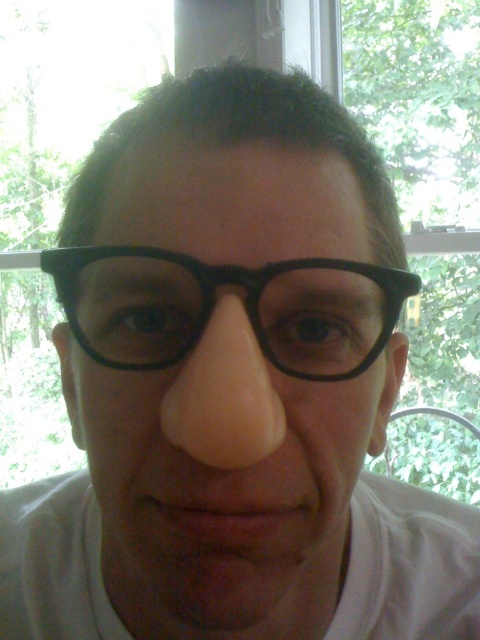
You are a photographer adjusting your camera settings to capture a close portrait. You notice the matte black glasses at center in your frame. If your camera has a minimum focusing distance of 10 inches, will you need to adjust your position to ensure the glasses are in focus?

The matte black glasses at center are only 8.62 inches away from the viewer, which is closer than the camera minimum focusing distance of 10 inches. You need to move back or increase the distance to ensure the glasses are in focus.

In the scene shown: You are trying to decide which pair of glasses to wear for a casual outdoor event. You see both the matte black glasses at center and the black plastic glasses at center in the image. Based on their positions in the photo, which pair is positioned to the right?

The matte black glasses at center is to the right of black plastic glasses at center, so the matte black glasses at center is positioned to the right.